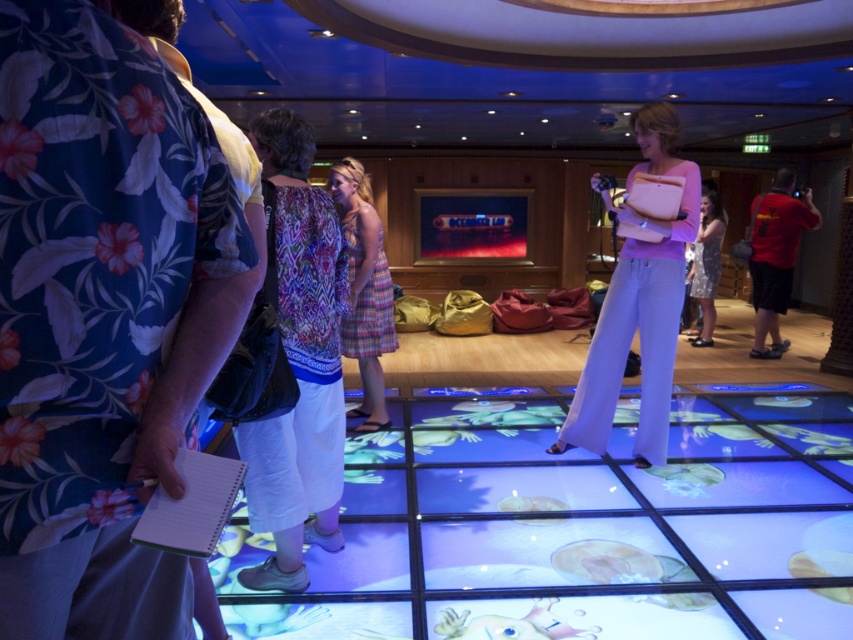
Between plaid fabric dress at center and red shirt at right, which one is positioned higher?

red shirt at right is above.

Is point (358, 305) farther from viewer compared to point (782, 264)?

No, (358, 305) is closer to viewer.

Does point (339, 177) lie behind point (766, 256)?

No, it is not.

Find the location of a particular element. The height and width of the screenshot is (640, 853). plaid fabric dress at center is located at coordinates (364, 291).

How far apart are pink fabric purse at center and red shirt at right?

The distance of pink fabric purse at center from red shirt at right is 3.63 meters.

Does pink fabric purse at center have a smaller size compared to red shirt at right?

Indeed, pink fabric purse at center has a smaller size compared to red shirt at right.

Between point (607, 403) and point (769, 234), which one is positioned behind?

The point (769, 234) is more distant.

I want to click on pink fabric purse at center, so click(637, 301).

Is printed fabric blouse at center wider than plaid fabric dress at center?

Incorrect, printed fabric blouse at center's width does not surpass plaid fabric dress at center's.

You are a GUI agent. You are given a task and a screenshot of the screen. Output one action in this format:
    pyautogui.click(x=<x>, y=<y>)
    Task: Click on the printed fabric blouse at center
    Image resolution: width=853 pixels, height=640 pixels.
    Given the screenshot: What is the action you would take?
    pyautogui.click(x=299, y=364)

Image resolution: width=853 pixels, height=640 pixels. In order to click on printed fabric blouse at center in this screenshot , I will do `click(299, 364)`.